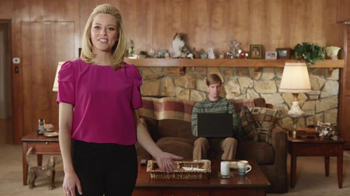
Where is `wood panel walls`? The width and height of the screenshot is (350, 196). wood panel walls is located at coordinates (207, 20).